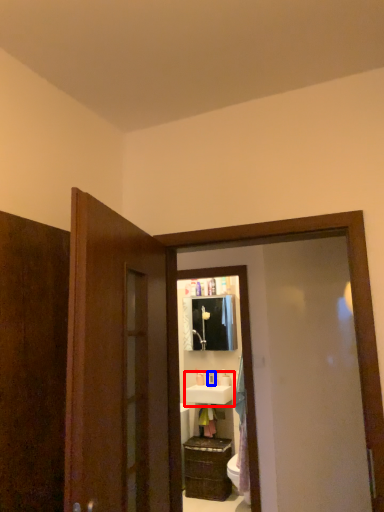
Question: Which point is further to the camera, sink (highlighted by a red box) or toiletry (highlighted by a blue box)?

Choices:
 (A) sink
 (B) toiletry

Answer: (B)